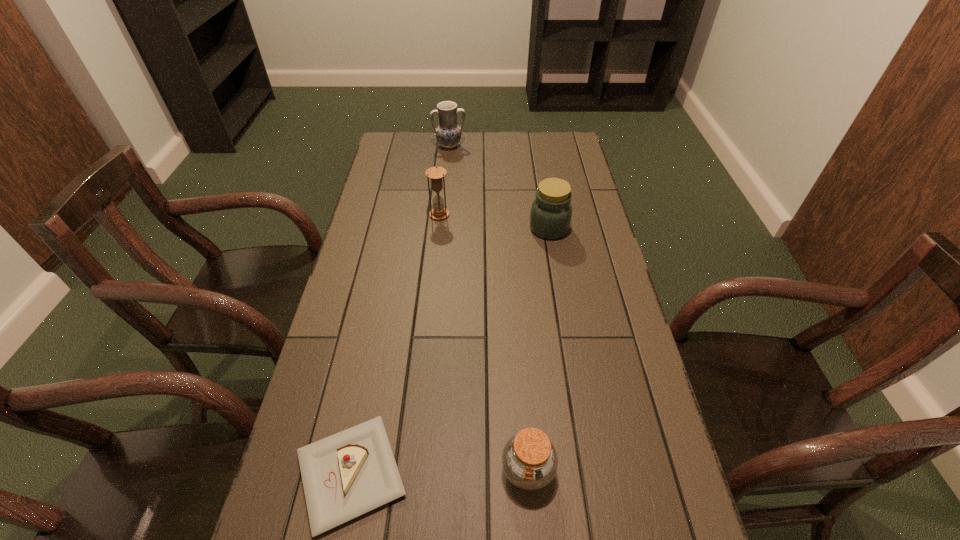
Identify the location of the farthest object. The width and height of the screenshot is (960, 540). (448, 134).

You are a GUI agent. You are given a task and a screenshot of the screen. Output one action in this format:
    pyautogui.click(x=<x>, y=<y>)
    Task: Click on the hourglass
    
    Given the screenshot: What is the action you would take?
    pyautogui.click(x=436, y=174)

You are a GUI agent. You are given a task and a screenshot of the screen. Output one action in this format:
    pyautogui.click(x=<x>, y=<y>)
    Task: Click on the right jar
    
    Given the screenshot: What is the action you would take?
    pyautogui.click(x=551, y=211)

Locate an element on the screen. The height and width of the screenshot is (540, 960). the rightmost object is located at coordinates (551, 211).

Locate an element on the screen. the fourth object from left to right is located at coordinates (529, 459).

Where is `the left jar`? The width and height of the screenshot is (960, 540). the left jar is located at coordinates (529, 459).

The width and height of the screenshot is (960, 540). In order to click on cake in this screenshot , I will do `click(350, 473)`.

I want to click on vacant space located on the front of the pottery, so click(444, 199).

Locate an element on the screen. The width and height of the screenshot is (960, 540). blank space located 0.090m on the back of the hourglass is located at coordinates (442, 194).

Image resolution: width=960 pixels, height=540 pixels. Find the location of `free space located 0.050m on the front of the rightmost object`. free space located 0.050m on the front of the rightmost object is located at coordinates (553, 252).